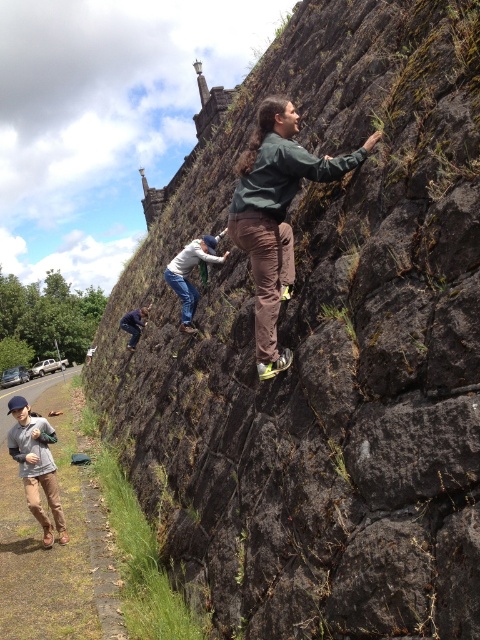
Can you confirm if green fabric jacket at center is positioned below khaki cotton pants at lower left?

No.

Who is shorter, green fabric jacket at center or khaki cotton pants at lower left?

khaki cotton pants at lower left is shorter.

Consider the image. Who is more forward, (260, 163) or (23, 454)?

Point (260, 163) is in front.

Where is `green fabric jacket at center`? This screenshot has width=480, height=640. green fabric jacket at center is located at coordinates (276, 214).